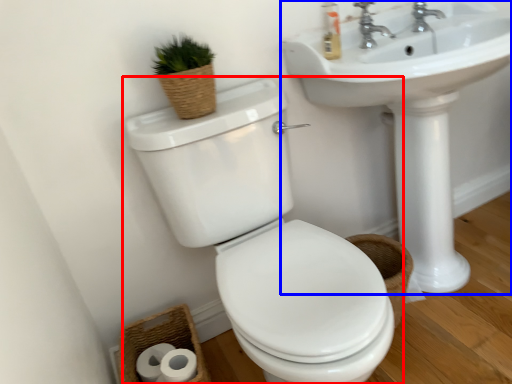
Question: Which point is closer to the camera, toilet (highlighted by a red box) or sink (highlighted by a blue box)?

Choices:
 (A) toilet
 (B) sink

Answer: (A)